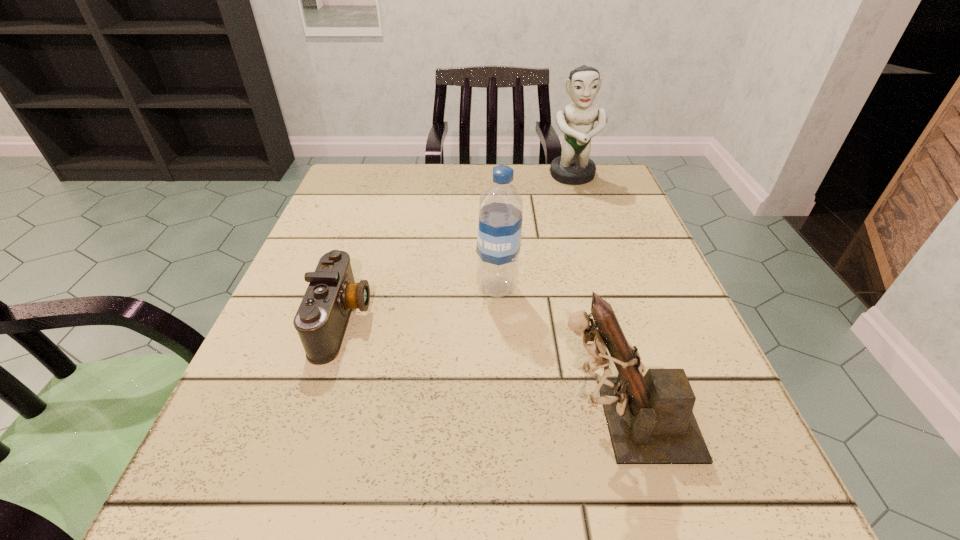
Where is `vacant area that lies between the third object from right to left and the farther figurine`? This screenshot has width=960, height=540. vacant area that lies between the third object from right to left and the farther figurine is located at coordinates [x=535, y=232].

Where is `vacant space that is in between the water bottle and the farther figurine`? vacant space that is in between the water bottle and the farther figurine is located at coordinates (535, 232).

At what (x,y) coordinates should I click in order to perform the action: click on unoccupied area between the farthest object and the camera. Please return your answer as a coordinate pair (x, y). Looking at the image, I should click on coord(458,248).

Where is `object that is the third nearest to the nearest object`? The image size is (960, 540). object that is the third nearest to the nearest object is located at coordinates (573, 167).

Locate which object is the closest to the nearest object. Please provide its 2D coordinates. Your answer should be formatted as a tuple, i.e. [(x, y)], where the tuple contains the x and y coordinates of a point satisfying the conditions above.

[(500, 211)]

At what (x,y) coordinates should I click in order to perform the action: click on free space that satisfies the following two spatial constraints: 1. on the front-facing side of the farther figurine; 2. on the lens of the camera. Please return your answer as a coordinate pair (x, y). This screenshot has height=540, width=960. Looking at the image, I should click on (620, 321).

Image resolution: width=960 pixels, height=540 pixels. Identify the location of vacant region that satisfies the following two spatial constraints: 1. on the front-facing side of the farthest object; 2. on the front-facing side of the nearer figurine. (653, 420).

Image resolution: width=960 pixels, height=540 pixels. In order to click on blank area in the image that satisfies the following two spatial constraints: 1. on the front-facing side of the farther figurine; 2. on the front-facing side of the nearest object in this screenshot , I will do `click(653, 420)`.

What are the coordinates of `vacant space that satisfies the following two spatial constraints: 1. on the front-facing side of the farther figurine; 2. on the label of the water bottle` in the screenshot? It's located at (610, 288).